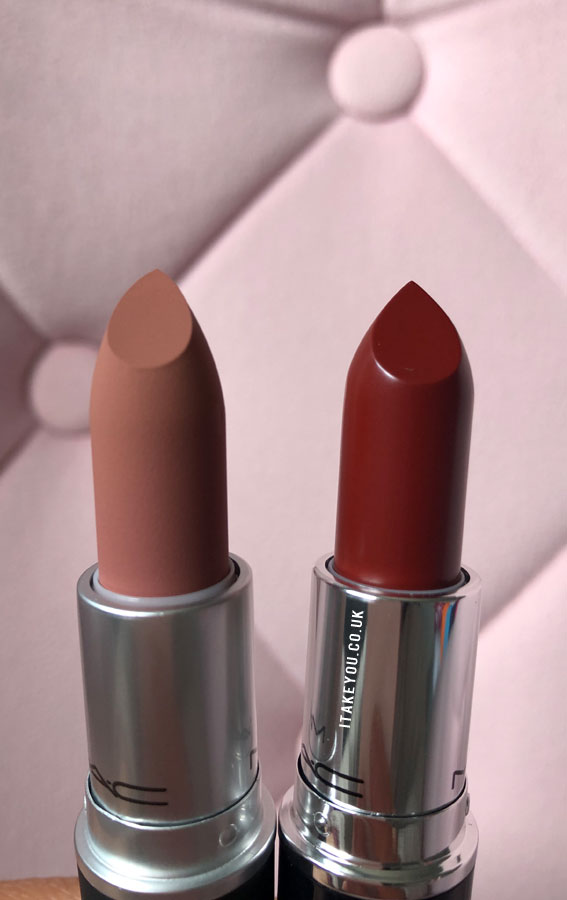
I want to click on sofa creases, so click(315, 14), click(256, 182), click(438, 13), click(505, 212), click(270, 652), click(524, 585), click(24, 315), click(14, 442).